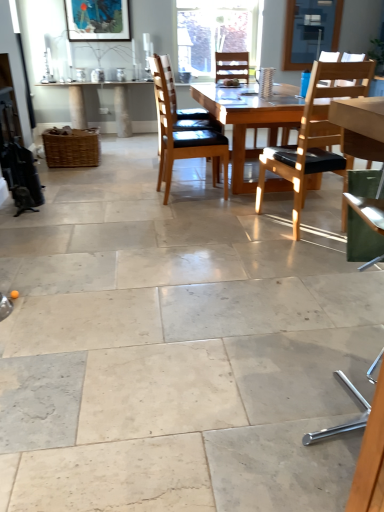
You are a GUI agent. You are given a task and a screenshot of the screen. Output one action in this format:
    pyautogui.click(x=<x>, y=<y>)
    Task: Click on the free area in between light brown wood chair at center right, which is the 3th chair from left to right, and green fabric chair at right, positioned as the 2th chair in right-to-left order
    This screenshot has width=384, height=512.
    Given the screenshot: What is the action you would take?
    pyautogui.click(x=322, y=306)